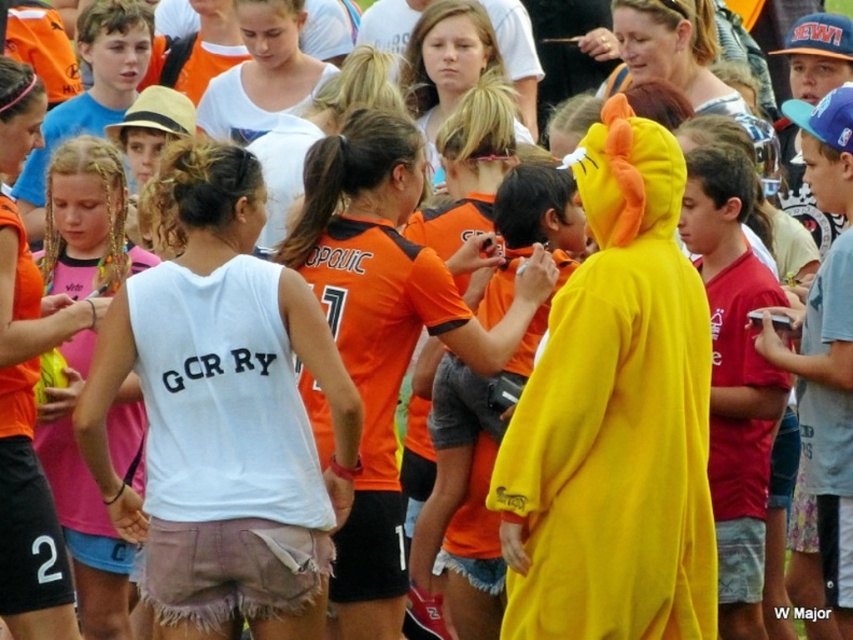
You are a photographer at the event and want to capture both the white cotton tank top at center and the matte pink shirt at center in a single shot. Which shirt should you position your camera to the left of to include both?

To include both the white cotton tank top at center and the matte pink shirt at center in the shot, position the camera to the left of the white cotton tank top at center since it is to the right of the matte pink shirt at center.

You are at a sports event and see a point marked at coordinates (384, 332). Which object in the scene does this point lie on?

The point at coordinates (384, 332) lies on the orange jersey at center.

You are a photographer trying to capture a closeup of the white cotton tank top at center and the matte pink shirt at center. Which one should you zoom in on to ensure it fits within the frame without cropping?

The white cotton tank top at center is wider than the matte pink shirt at center, so you should zoom in on the white cotton tank top at center to ensure it fits within the frame without cropping.